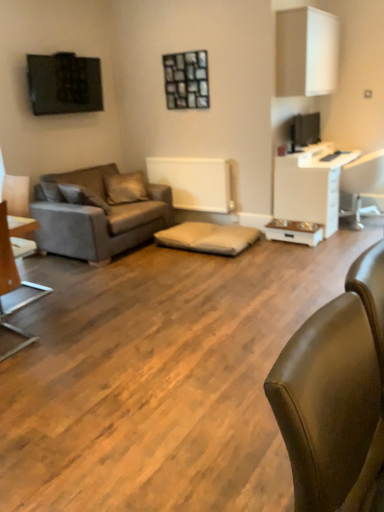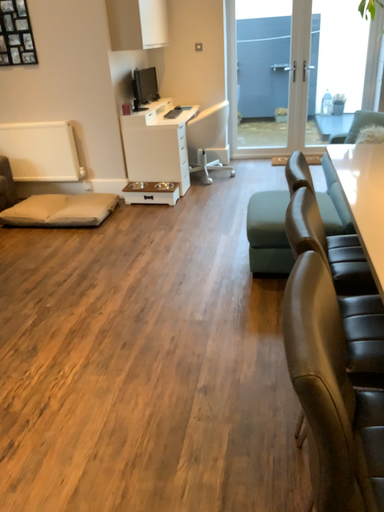
Question: How did the camera likely rotate when shooting the video?

Choices:
 (A) rotated right
 (B) rotated left

Answer: (A)